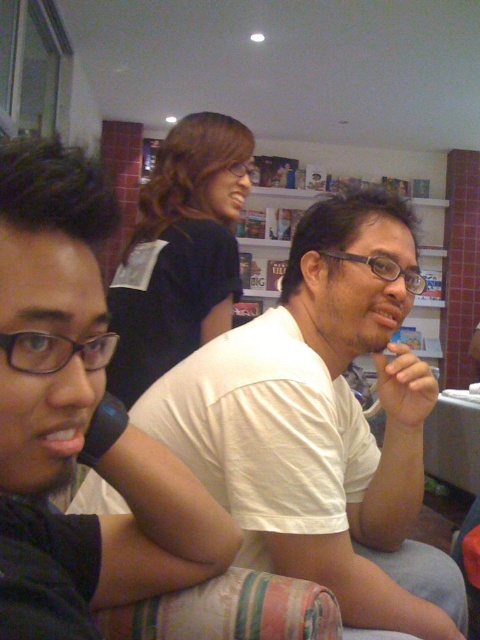
Can you confirm if white glossy bookshelf at upper center is taller than pink matte lips at center?

Yes, white glossy bookshelf at upper center is taller than pink matte lips at center.

Which is behind, point (257, 268) or point (38, 445)?

The point (257, 268) is behind.

This screenshot has height=640, width=480. I want to click on white glossy bookshelf at upper center, so click(271, 218).

Can you confirm if white matte t-shirt at center is smaller than black matte shirt at upper center?

Indeed, white matte t-shirt at center has a smaller size compared to black matte shirt at upper center.

Consider the image. Who is more distant from viewer, (6, 328) or (230, 120)?

The point (230, 120) is more distant.

Consider the image. Who is more distant from viewer, (128, 452) or (147, 266)?

Positioned behind is point (147, 266).

Find the location of a particular element. white matte t-shirt at center is located at coordinates (76, 417).

Is white matte shirt at center above black matte shirt at upper center?

Incorrect, white matte shirt at center is not positioned above black matte shirt at upper center.

Which is above, white matte shirt at center or black matte shirt at upper center?

black matte shirt at upper center

Between point (404, 481) and point (132, 252), which one is positioned behind?

Positioned behind is point (132, 252).

The image size is (480, 640). Find the location of `white matte shirt at center`. white matte shirt at center is located at coordinates (324, 420).